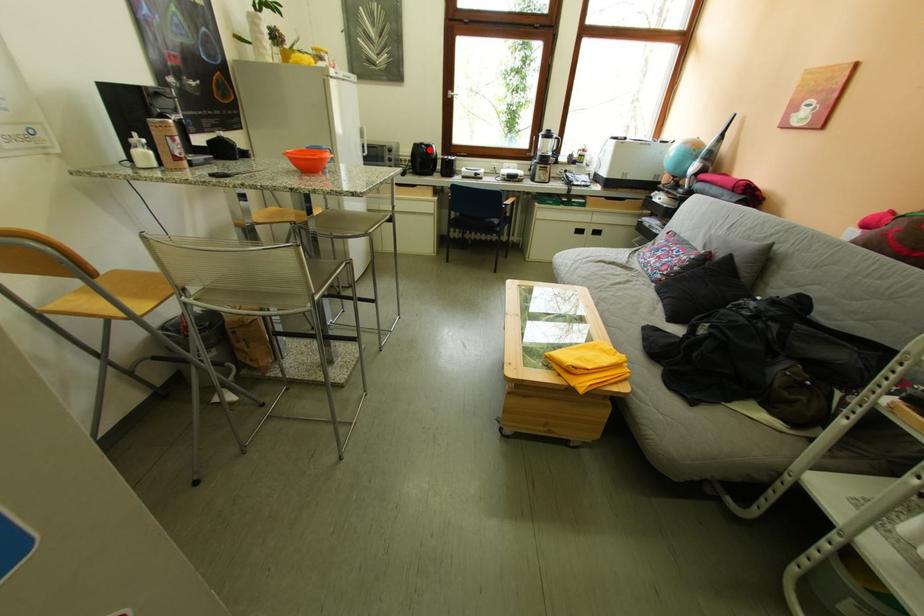
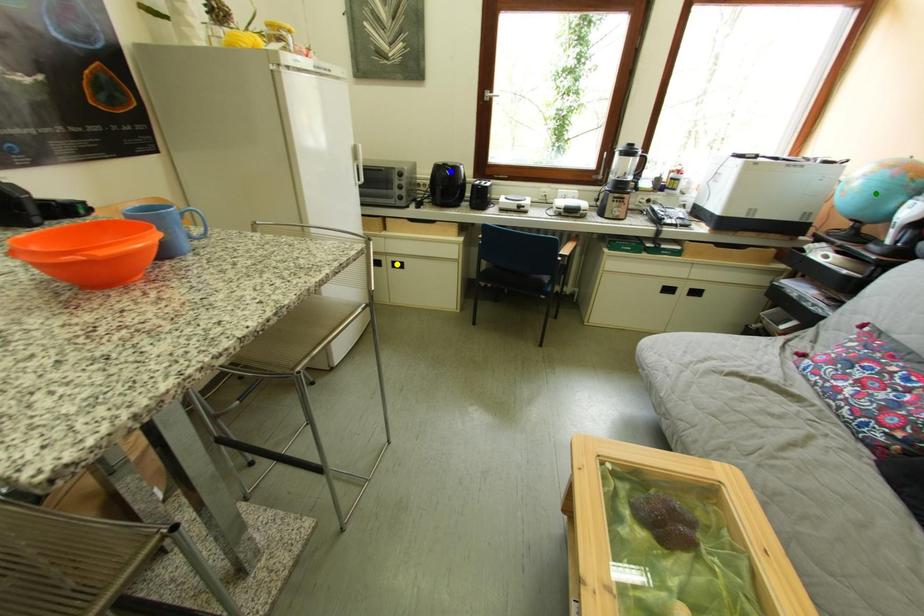
Question: I am providing you with two images of the same scene from different viewpoints. A red point is marked on the first image. You are given multiple points on the second image. Which spot in image 2 lines up with the point in image 1?

Choices:
 (A) green point
 (B) yellow point
 (C) blue point

Answer: (C)